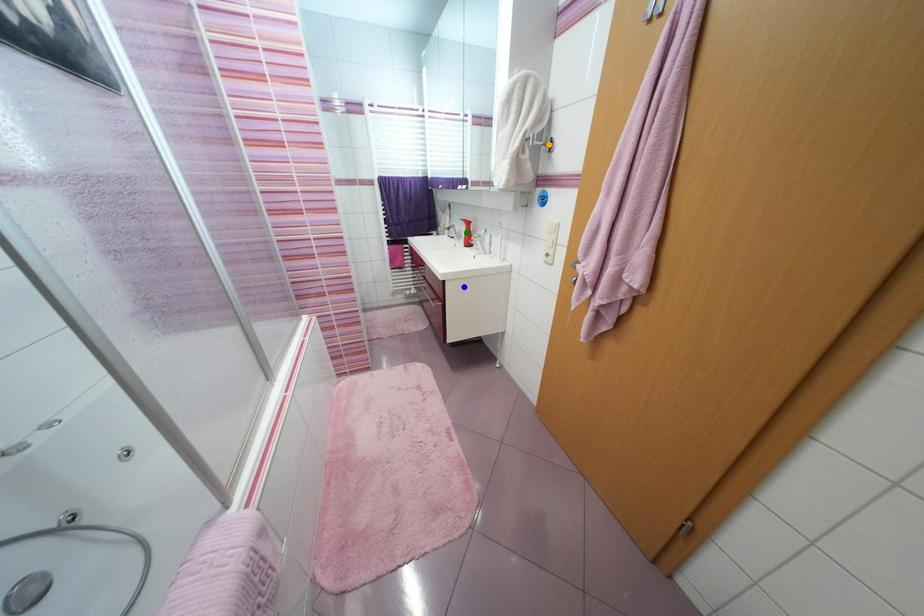
Order these from farthest to nearest:
1. green point
2. blue point
3. orange point

green point, blue point, orange point